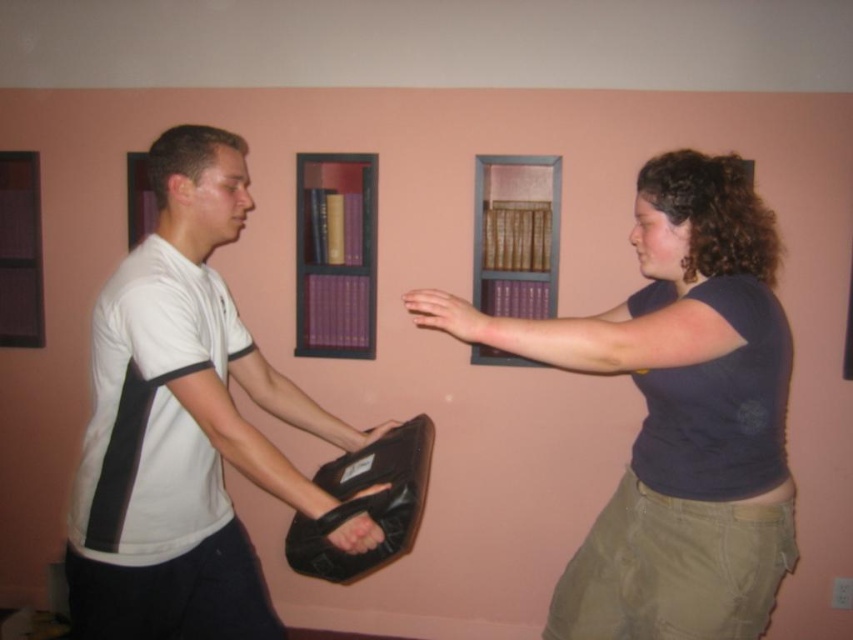
You are standing in the room and want to hand a small package to the person wearing the white matte shirt at center. The purple matte bookshelf at center is blocking your path. Can you reach the person without moving the bookshelf?

The white matte shirt at center is closer to the viewer than the purple matte bookshelf at center, so you can reach the person without moving the bookshelf because the person is in front of the bookshelf.

You are an observer standing in front of the two people. Which object is located higher up between the matte blue shirt at center and the matte black bag at center?

The matte blue shirt at center is positioned over the matte black bag at center, so it is higher up.